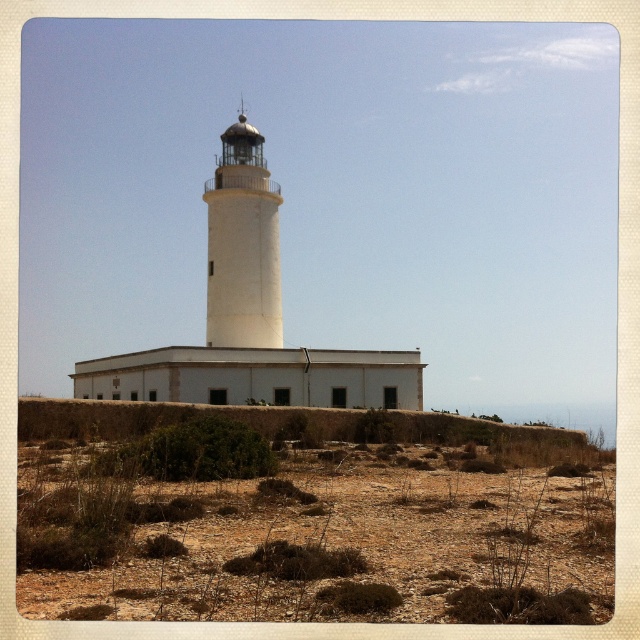
Question: Is brown gravelly dirt field at lower center bigger than white smooth tower at center?

Choices:
 (A) no
 (B) yes

Answer: (A)

Question: Which of the following is the closest to the observer?

Choices:
 (A) (282, 198)
 (B) (272, 477)

Answer: (B)

Question: Which of the following is the closest to the observer?

Choices:
 (A) (260, 148)
 (B) (436, 573)

Answer: (B)

Question: Is brown gravelly dirt field at lower center further to camera compared to white smooth tower at center?

Choices:
 (A) yes
 (B) no

Answer: (B)

Question: Is brown gravelly dirt field at lower center behind white smooth tower at center?

Choices:
 (A) no
 (B) yes

Answer: (A)